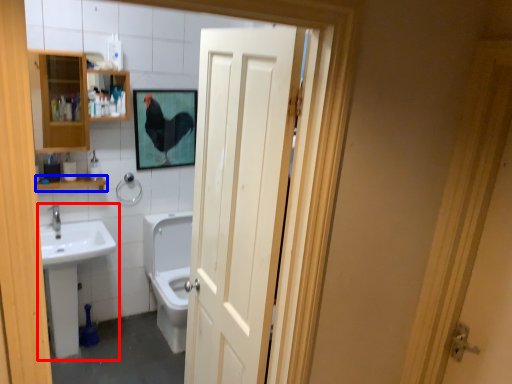
Question: Which object is closer to the camera taking this photo, sink (highlighted by a red box) or balustrade (highlighted by a blue box)?

Choices:
 (A) sink
 (B) balustrade

Answer: (A)